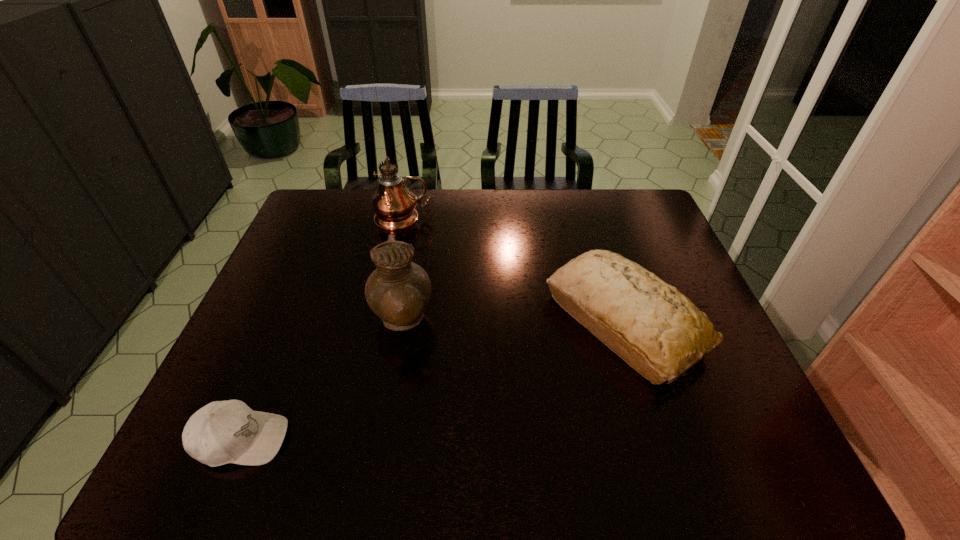
Find the location of a particular element. This screenshot has height=540, width=960. oil lamp is located at coordinates (394, 204).

Where is `the farthest object`? The width and height of the screenshot is (960, 540). the farthest object is located at coordinates (394, 204).

Identify the location of the third shortest object. tap(398, 291).

Where is `the rightmost object`? The image size is (960, 540). the rightmost object is located at coordinates (658, 331).

Find the location of `the second shortest object`. the second shortest object is located at coordinates (658, 331).

Find the location of `the nearest object`. the nearest object is located at coordinates (222, 432).

Locate an element on the screen. The height and width of the screenshot is (540, 960). baseball cap is located at coordinates (222, 432).

Find the location of a particular element. The height and width of the screenshot is (540, 960). vacant space located on the right of the oil lamp is located at coordinates (544, 219).

What are the coordinates of `vacant space located at the spout of the second tallest object` in the screenshot? It's located at (502, 321).

At what (x,y) coordinates should I click in order to perform the action: click on free space located 0.320m on the left of the rightmost object. Please return your answer as a coordinate pair (x, y). The width and height of the screenshot is (960, 540). Looking at the image, I should click on (425, 322).